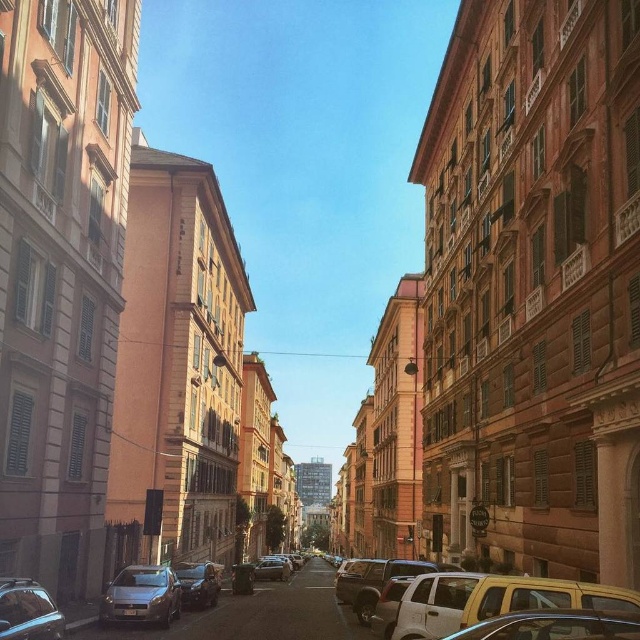
Question: Which point is farther from the camera taking this photo?

Choices:
 (A) (269, 573)
 (B) (33, 588)

Answer: (A)

Question: Which object is the farthest from the matte black car at lower left?

Choices:
 (A) shiny black car at lower left
 (B) matte black car at center
 (C) silver metallic car at lower left

Answer: (B)

Question: Is shiny black car at lower left positioned before matte black car at lower left?

Choices:
 (A) yes
 (B) no

Answer: (A)

Question: Which object is farther from the camera taking this photo?

Choices:
 (A) shiny black car at lower left
 (B) matte black car at center
 (C) silver metallic car at lower left

Answer: (B)

Question: Can you confirm if yellow matte van at lower right is smaller than shiny black car at lower left?

Choices:
 (A) yes
 (B) no

Answer: (B)

Question: Can you confirm if yellow matte van at lower right is positioned below matte black car at lower left?

Choices:
 (A) no
 (B) yes

Answer: (A)